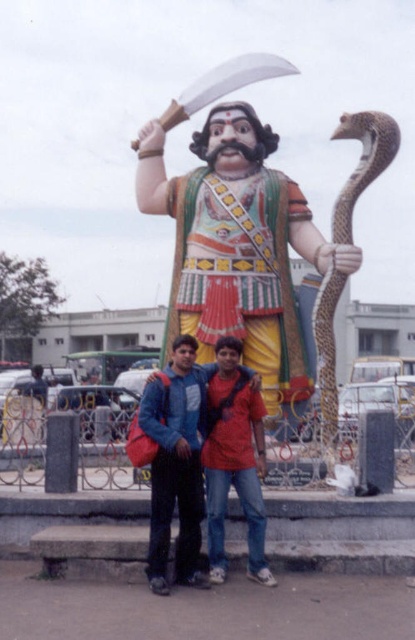
You are a photographer trying to capture a wide shot of the polished bronze statue at center. The statue is 149.12 feet away from you. Your camera can focus on subjects within 150 feet. Will the statue be in focus?

The polished bronze statue at center is 149.12 feet away from the camera, which is within the 150 feet focusing range. Therefore, the statue will be in focus.